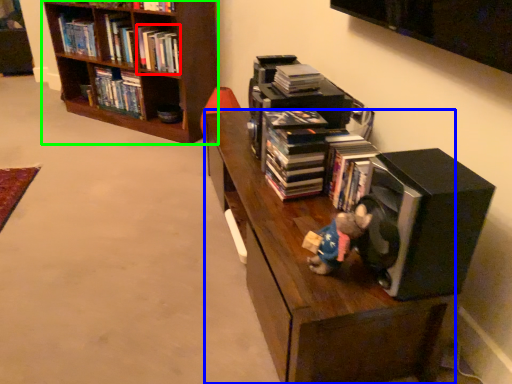
Question: Which object is the closest to the book (highlighted by a red box)? Choose among these: shelf (highlighted by a blue box) or bookcase (highlighted by a green box).

Choices:
 (A) shelf
 (B) bookcase

Answer: (B)